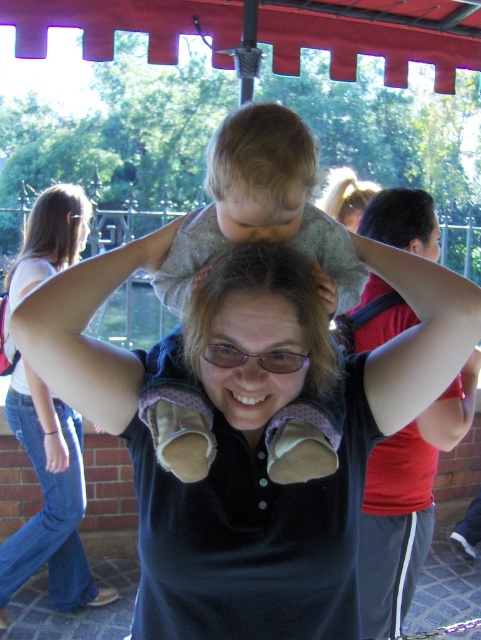
Can you confirm if blonde hair at center is smaller than blonde hair at upper center?

Yes, blonde hair at center is smaller than blonde hair at upper center.

Is blonde hair at center positioned behind blonde hair at upper center?

No, blonde hair at center is closer to the viewer.

Looking at this image, measure the distance between point (302,120) and camera.

A distance of 1.38 meters exists between point (302,120) and camera.

Where is `blonde hair at center`? The width and height of the screenshot is (481, 640). blonde hair at center is located at coordinates (261, 172).

You are a GUI agent. You are given a task and a screenshot of the screen. Output one action in this format:
    pyautogui.click(x=<x>, y=<y>)
    Task: Click on the matte black arm at upper center
    Image resolution: width=481 pixels, height=640 pixels.
    Given the screenshot: What is the action you would take?
    pyautogui.click(x=88, y=337)

Can you confirm if matte black hair at center is bigger than blonde hair at upper center?

No.

Between matte black hair at center and blonde hair at upper center, which one has more height?

blonde hair at upper center is taller.

At what (x,y) coordinates should I click in order to perform the action: click on matte black hair at center. Please return your answer as a coordinate pair (x, y). The width and height of the screenshot is (481, 640). Looking at the image, I should click on (258, 330).